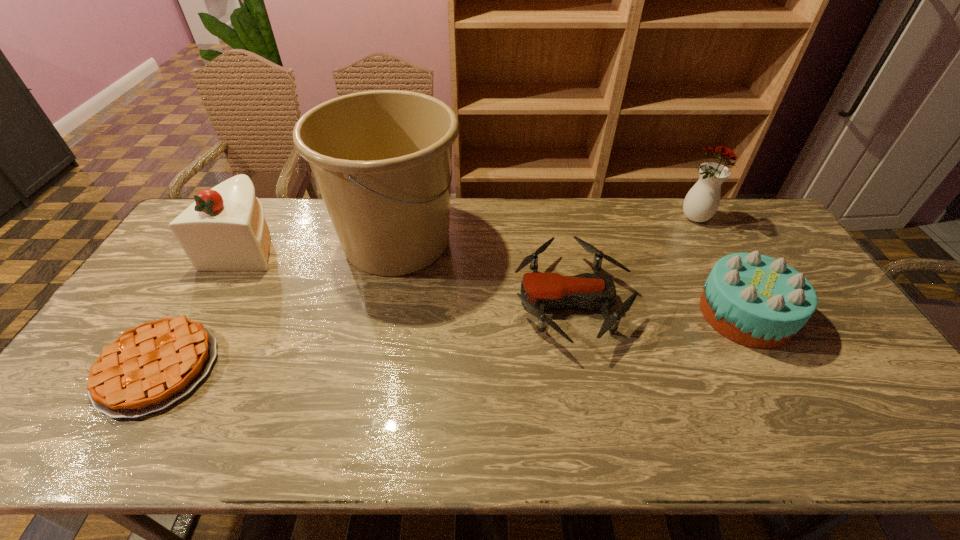
At what (x,y) coordinates should I click in order to perform the action: click on vacant space at the near left corner of the desktop. Please return your answer as a coordinate pair (x, y). This screenshot has width=960, height=540. Looking at the image, I should click on (64, 436).

Identify the location of vacant space at the far right corner. Image resolution: width=960 pixels, height=540 pixels. (733, 234).

Where is `free space between the farther cake and the shortest object`? Image resolution: width=960 pixels, height=540 pixels. free space between the farther cake and the shortest object is located at coordinates (203, 306).

Where is `empty space between the vase and the fourth object from left to right`? Image resolution: width=960 pixels, height=540 pixels. empty space between the vase and the fourth object from left to right is located at coordinates (634, 260).

Locate an element on the screen. The image size is (960, 540). vacant space that is in between the left cake and the shorter cake is located at coordinates (496, 279).

Locate an element on the screen. The width and height of the screenshot is (960, 540). free point between the pie and the nearer cake is located at coordinates (451, 341).

You are a GUI agent. You are given a task and a screenshot of the screen. Output one action in this format:
    pyautogui.click(x=<x>, y=<y>)
    Task: Click on the unoccupied position between the vase and the left cake
    
    Given the screenshot: What is the action you would take?
    pyautogui.click(x=471, y=231)

Locate an element on the screen. The image size is (960, 540). free area in between the drone and the shorter cake is located at coordinates (659, 307).

Where is `vacant space that's between the right cake and the pie`? This screenshot has width=960, height=540. vacant space that's between the right cake and the pie is located at coordinates (451, 341).

Identify the location of free space between the fourth object from left to right and the tallest object. This screenshot has height=540, width=960. (484, 271).